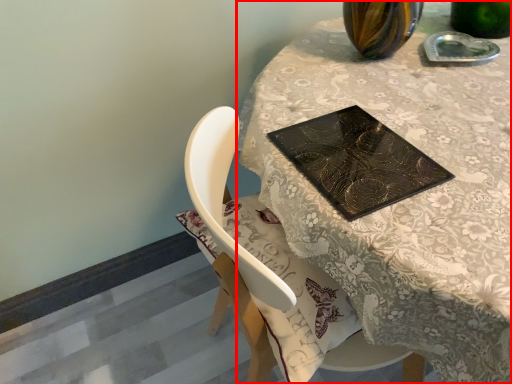
Question: In this image, where is table (annotated by the red box) located relative to book cover?

Choices:
 (A) left
 (B) right

Answer: (B)